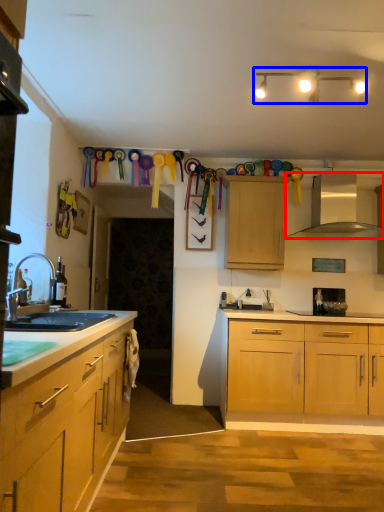
Question: Which point is closer to the camera, exhaust hood (highlighted by a red box) or lamp (highlighted by a blue box)?

Choices:
 (A) exhaust hood
 (B) lamp

Answer: (B)